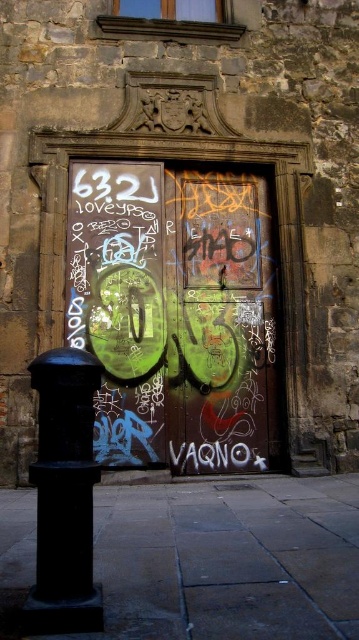
Question: Observing the image, what is the correct spatial positioning of green matte door at center in reference to black matte pole at lower left?

Choices:
 (A) right
 (B) left

Answer: (A)

Question: Can you confirm if green matte door at center is positioned to the right of black matte pole at lower left?

Choices:
 (A) yes
 (B) no

Answer: (A)

Question: Is green matte door at center behind black matte pole at lower left?

Choices:
 (A) yes
 (B) no

Answer: (A)

Question: Which point is closer to the camera?

Choices:
 (A) black matte pole at lower left
 (B) green matte door at center

Answer: (A)